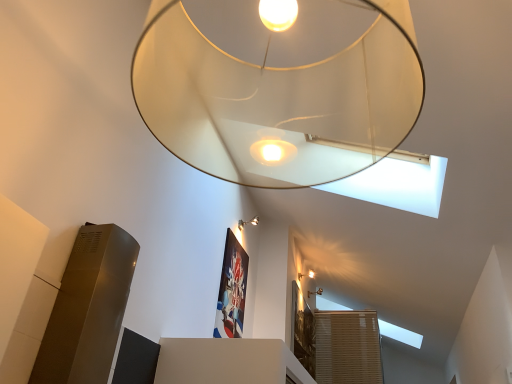
Question: Does point (310, 271) appear closer or farther from the camera than point (297, 140)?

Choices:
 (A) closer
 (B) farther

Answer: (B)

Question: From a real-world perspective, is matte gold wall sconce at upper right, acting as the third lamp starting from the top, physically located above or below translucent glass lampshade at upper center, acting as the second lamp starting from the left?

Choices:
 (A) above
 (B) below

Answer: (A)

Question: Which object is positioned closest to the matte gold wall sconce at upper right, acting as the third lamp starting from the top?

Choices:
 (A) matte silver wall sconce at upper center, the second lamp when ordered from front to back
 (B) translucent glass lampshade at upper center, the first lamp in the top-to-bottom sequence
 (C) matte white lampshade at upper center, which appears as the 1th lamp when viewed from the right
 (D) satin silver lift at lower left

Answer: (C)

Question: Based on their relative distances, which object is nearer to the translucent glass lampshade at upper center, acting as the second lamp starting from the left?

Choices:
 (A) matte white lampshade at upper center, which appears as the 1th lamp when viewed from the right
 (B) matte gold wall sconce at upper right, acting as the second lamp starting from the right
 (C) satin silver lift at lower left
 (D) matte silver wall sconce at upper center, the second lamp when ordered from front to back

Answer: (C)